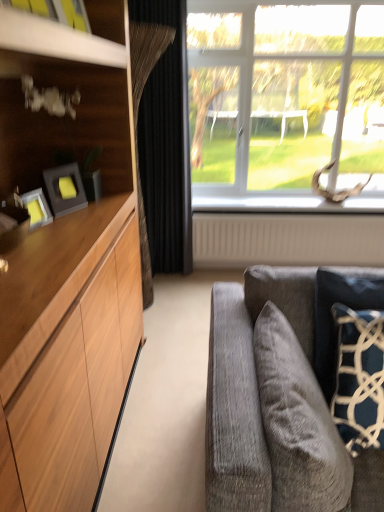
The height and width of the screenshot is (512, 384). In order to click on free spot above matte black picture frame at left (from a real-world perspective) in this screenshot , I will do `click(57, 170)`.